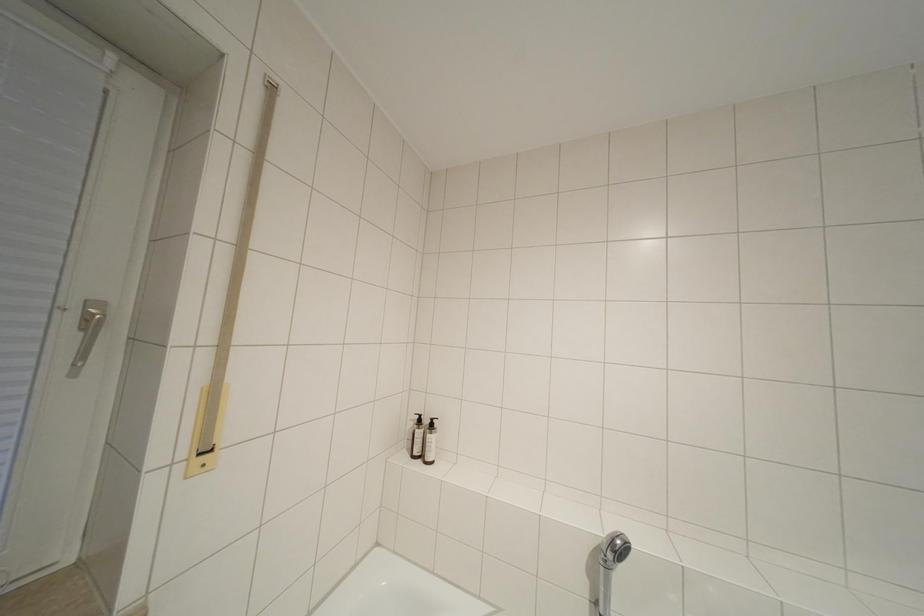
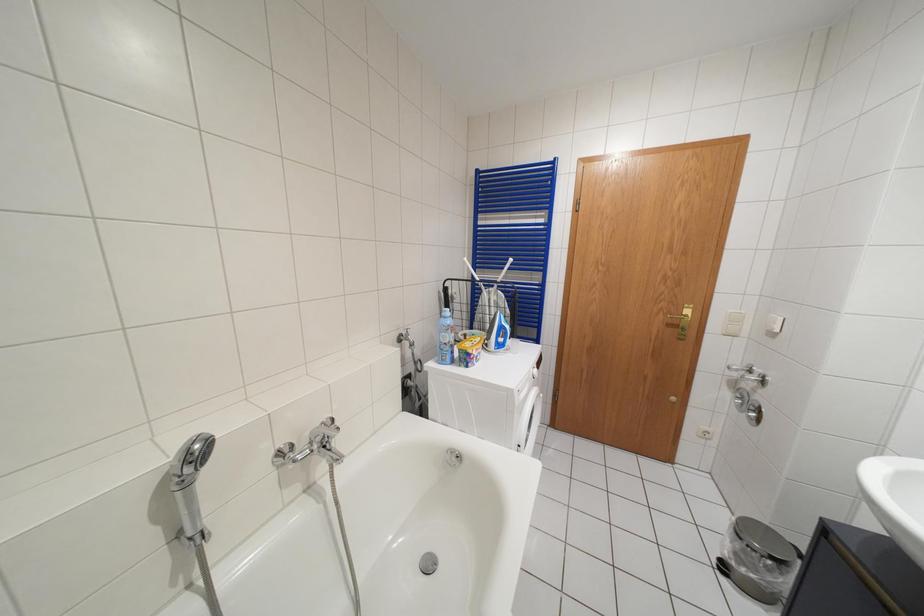
The images are taken continuously from a first-person perspective. In which direction is your viewpoint rotating?

The camera rotated toward right-down.